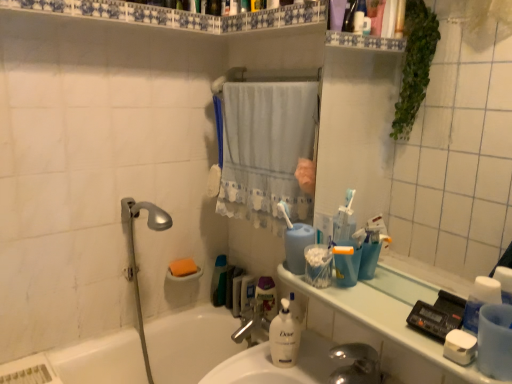
At what (x,y) coordinates should I click in order to perform the action: click on free spot above white glossy counter top at upper right (from a real-world perspective). Please return your answer as a coordinate pair (x, y). This screenshot has height=384, width=512. Looking at the image, I should click on (380, 317).